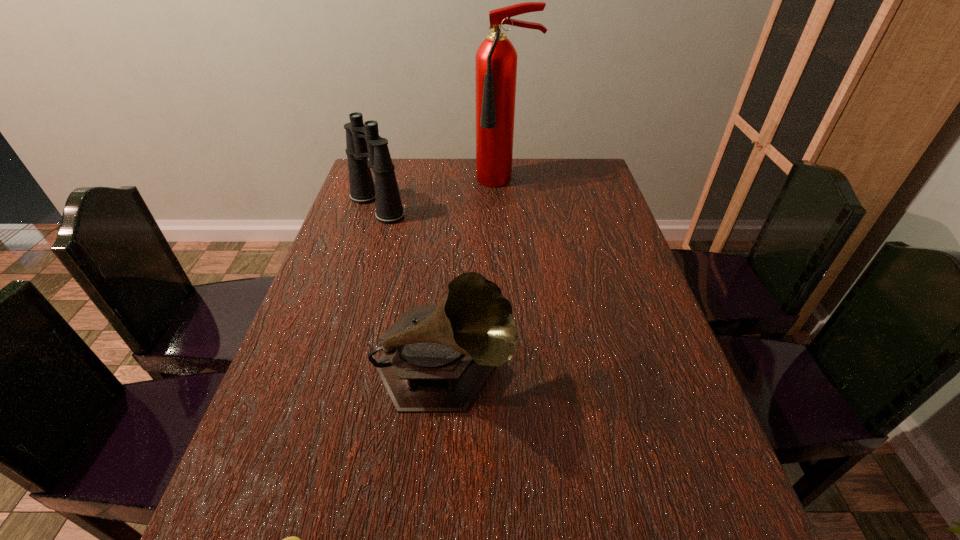
You are a GUI agent. You are given a task and a screenshot of the screen. Output one action in this format:
    pyautogui.click(x=<x>, y=<y>)
    Task: Click on the free space that satisfies the following two spatial constraints: 1. at the nozzle of the tallest object; 2. on the horn direction of the third farthest object
    
    Given the screenshot: What is the action you would take?
    pyautogui.click(x=521, y=373)

You are a GUI agent. You are given a task and a screenshot of the screen. Output one action in this format:
    pyautogui.click(x=<x>, y=<y>)
    Task: Click on the free spot that satisfies the following two spatial constraints: 1. at the nozzle of the tallest object; 2. on the horn direction of the third farthest object
    Image resolution: width=960 pixels, height=540 pixels.
    Given the screenshot: What is the action you would take?
    pyautogui.click(x=521, y=373)

At what (x,y) coordinates should I click in order to perform the action: click on vacant space that satisfies the following two spatial constraints: 1. at the nozzle of the fire extinguisher; 2. on the horn direction of the phonograph record. Please return your answer as a coordinate pair (x, y). This screenshot has height=540, width=960. Looking at the image, I should click on (521, 373).

Locate an element on the screen. free space that satisfies the following two spatial constraints: 1. at the nozzle of the fire extinguisher; 2. on the horn direction of the phonograph record is located at coordinates (521, 373).

At what (x,y) coordinates should I click in order to perform the action: click on vacant space that satisfies the following two spatial constraints: 1. at the nozzle of the tallest object; 2. on the horn direction of the third farthest object. Please return your answer as a coordinate pair (x, y). This screenshot has width=960, height=540. Looking at the image, I should click on (521, 373).